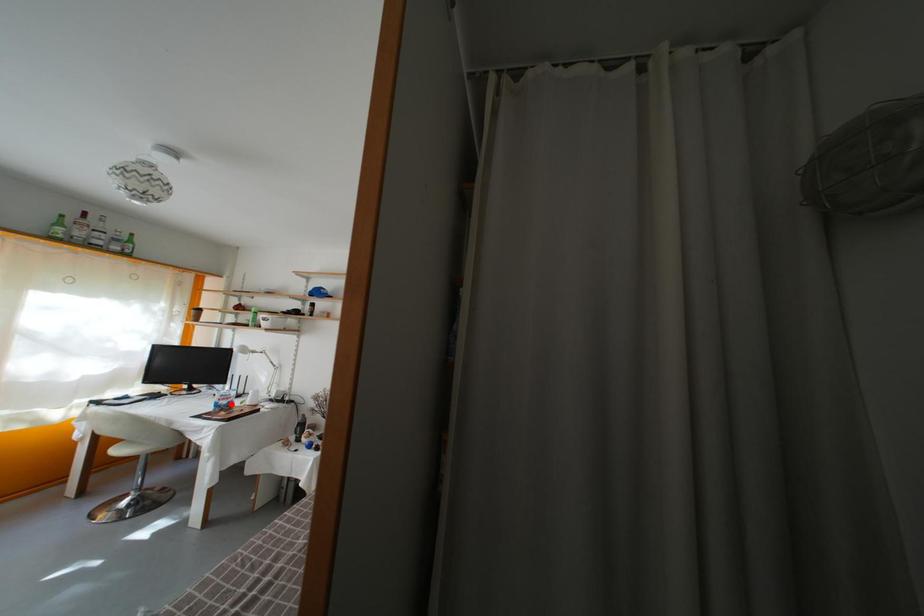
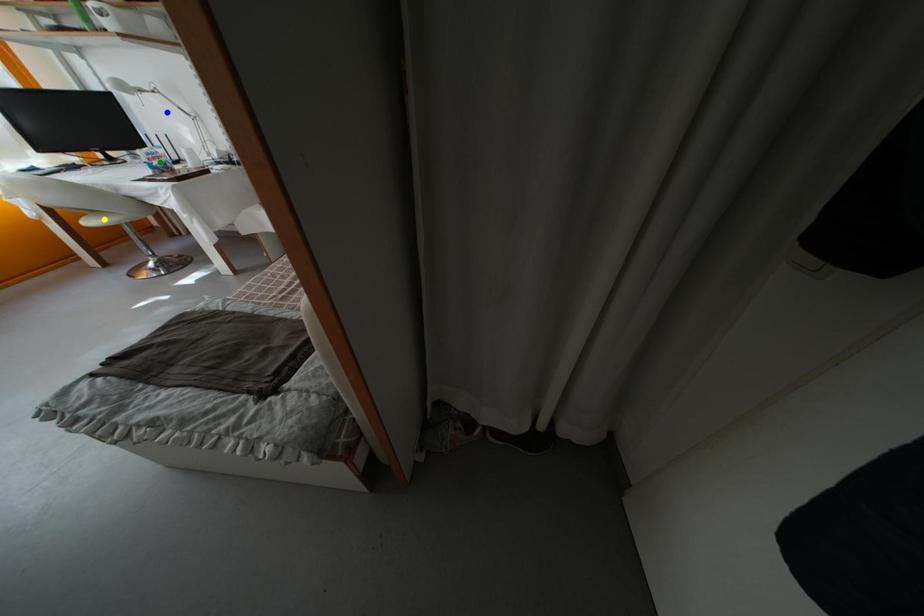
Question: I am providing you with two images of the same scene from different viewpoints. A red point is marked on the first image. You are given multiple points on the second image. Which point in image 2 is actually the same real-world point as the red point in image 1?

Choices:
 (A) yellow point
 (B) green point
 (C) blue point

Answer: (B)